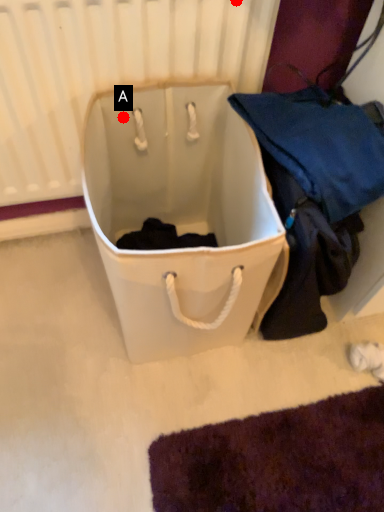
Question: Two points are circled on the image, labeled by A and B beside each circle. Which point appears closest to the camera in this image?

Choices:
 (A) A is closer
 (B) B is closer

Answer: (B)